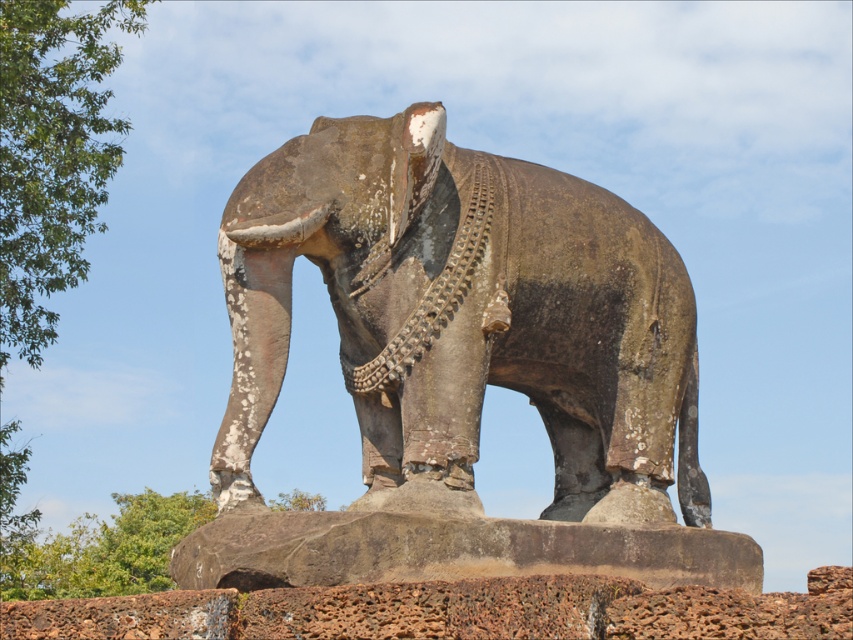
Question: Which point is closer to the camera?

Choices:
 (A) green leafy tree at upper left
 (B) rusty stone elephant at center

Answer: (B)

Question: Can you confirm if rusty stone elephant at center is smaller than green leafy tree at upper left?

Choices:
 (A) no
 (B) yes

Answer: (B)

Question: Is rusty stone elephant at center below green leafy tree at upper left?

Choices:
 (A) yes
 (B) no

Answer: (A)

Question: Is rusty stone elephant at center to the right of green leafy tree at upper left from the viewer's perspective?

Choices:
 (A) yes
 (B) no

Answer: (A)

Question: Among these points, which one is farthest from the camera?

Choices:
 (A) (70, 113)
 (B) (393, 412)

Answer: (A)

Question: Which point is closer to the camera?

Choices:
 (A) (410, 378)
 (B) (33, 294)

Answer: (A)